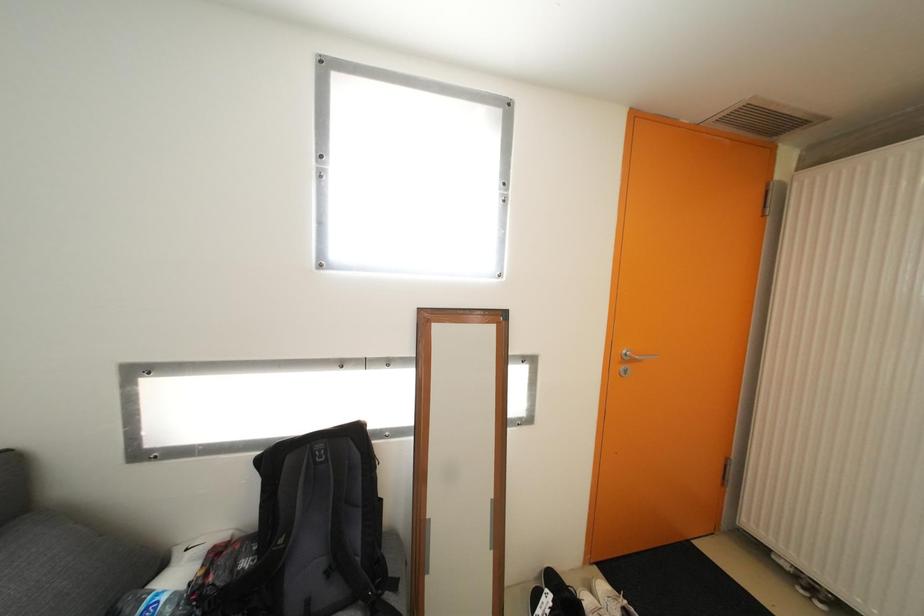
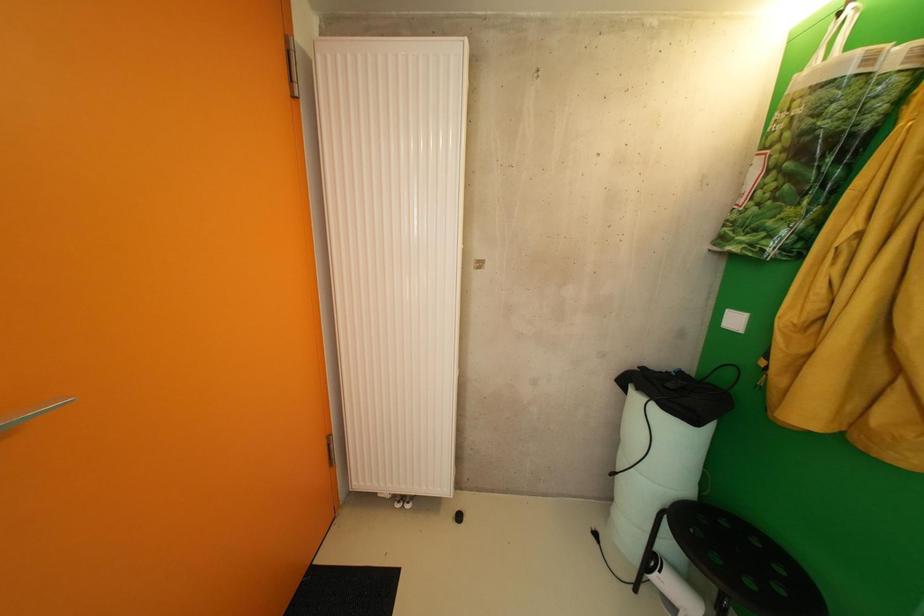
Question: The camera is either moving clockwise (left) or counter-clockwise (right) around the object. The first image is from the beginning of the video and the second image is from the end. Is the camera moving left or right when shooting the video?

Choices:
 (A) Left
 (B) Right

Answer: (A)